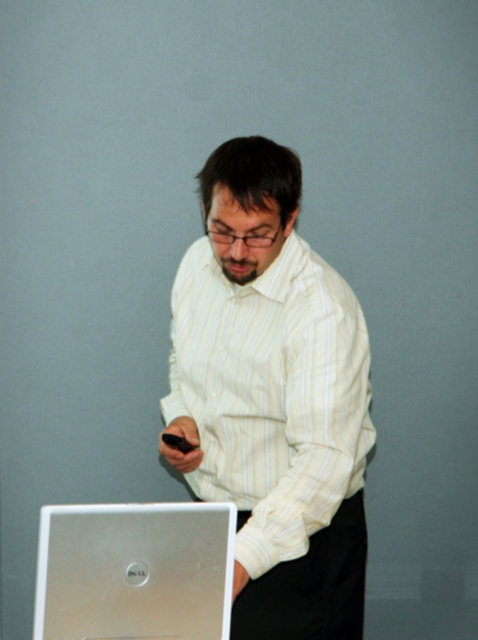
Is point (205, 541) behind point (182, 442)?

That is False.

Which is more to the left, silver metallic laptop at lower left or black matte smartphone at center?

Positioned to the left is silver metallic laptop at lower left.

Identify the location of silver metallic laptop at lower left. The image size is (478, 640). 134,570.

What are the coordinates of `silver metallic laptop at lower left` in the screenshot? It's located at (134, 570).

Does white striped shirt at center have a lesser width compared to black matte smartphone at center?

No.

Who is positioned more to the left, white striped shirt at center or black matte smartphone at center?

black matte smartphone at center is more to the left.

The height and width of the screenshot is (640, 478). What do you see at coordinates (271, 394) in the screenshot?
I see `white striped shirt at center` at bounding box center [271, 394].

Find the location of a particular element. Image resolution: width=478 pixels, height=640 pixels. white striped shirt at center is located at coordinates pos(271,394).

Is point (336, 408) positioned before point (65, 576)?

That is False.

Consider the image. Does white striped shirt at center appear on the right side of silver metallic laptop at lower left?

Correct, you'll find white striped shirt at center to the right of silver metallic laptop at lower left.

Find the location of `white striped shirt at center`. white striped shirt at center is located at coordinates (271, 394).

Locate an element on the screen. The image size is (478, 640). white striped shirt at center is located at coordinates (271, 394).